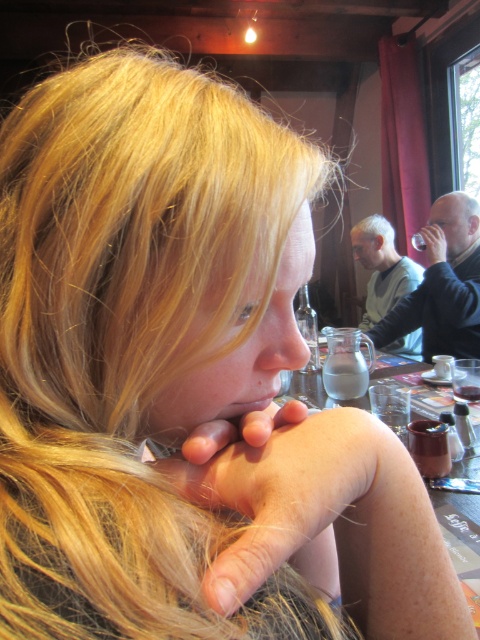
Question: Based on their relative distances, which object is farther from the matte black hand at upper right?

Choices:
 (A) pale skin/hair at center
 (B) transparent glass table at center
 (C) matte skin at lower center

Answer: (A)

Question: Considering the real-world distances, which object is closest to the matte skin at lower center?

Choices:
 (A) pale skin/hair at center
 (B) transparent glass table at center
 (C) matte black hand at upper right

Answer: (A)

Question: Which object is positioned farthest from the matte skin at lower center?

Choices:
 (A) matte black hand at upper right
 (B) transparent glass table at center

Answer: (A)

Question: Does pale skin/hair at center appear over matte black hand at upper right?

Choices:
 (A) yes
 (B) no

Answer: (B)

Question: Where is transparent glass table at center located in relation to matte black hand at upper right in the image?

Choices:
 (A) below
 (B) above

Answer: (A)

Question: Is matte skin at lower center to the right of matte black hand at upper right from the viewer's perspective?

Choices:
 (A) yes
 (B) no

Answer: (B)